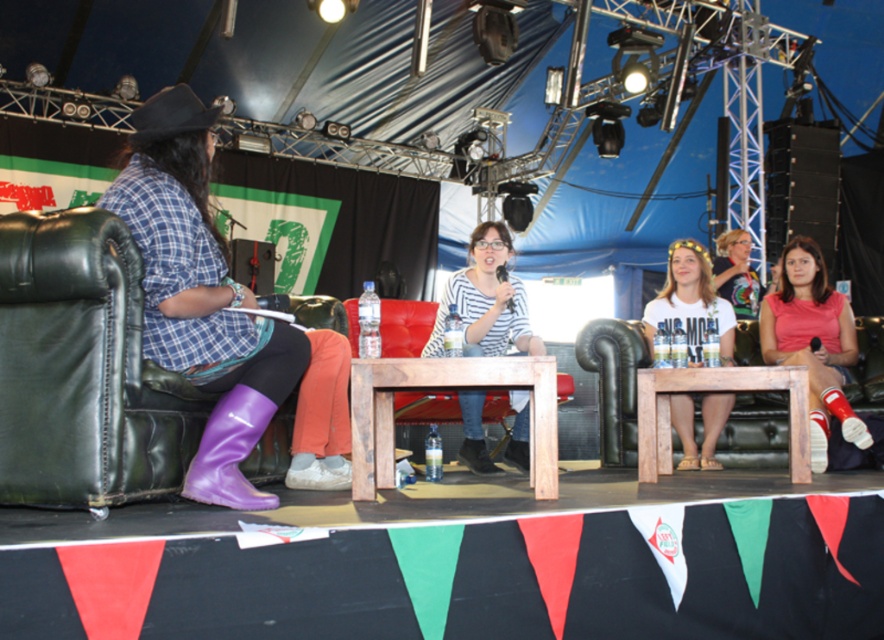
Does purple rubber boots at left appear over pink fabric shirt at center?

Indeed, purple rubber boots at left is positioned over pink fabric shirt at center.

Does point (225, 438) come behind point (776, 337)?

No, it is not.

Is point (269, 340) closer to camera compared to point (847, 417)?

Yes, it is in front of point (847, 417).

The height and width of the screenshot is (640, 884). Identify the location of purple rubber boots at left. (200, 296).

Can you confirm if pink fabric shirt at center is positioned to the left of striped cotton shirt at center?

In fact, pink fabric shirt at center is to the right of striped cotton shirt at center.

Is pink fabric shirt at center bigger than striped cotton shirt at center?

Correct, pink fabric shirt at center is larger in size than striped cotton shirt at center.

Between point (781, 266) and point (524, 307), which one is positioned in front?

Point (524, 307)

Locate an element on the screen. pink fabric shirt at center is located at coordinates (813, 342).

Is white cotton t-shirt at center smaller than purple rubber boot at lower left?

Incorrect, white cotton t-shirt at center is not smaller in size than purple rubber boot at lower left.

In order to click on white cotton t-shirt at center in this screenshot , I will do `click(690, 296)`.

Is point (680, 260) positioned after point (248, 490)?

Yes, point (680, 260) is farther from viewer.

Locate an element on the screen. Image resolution: width=884 pixels, height=640 pixels. white cotton t-shirt at center is located at coordinates (690, 296).